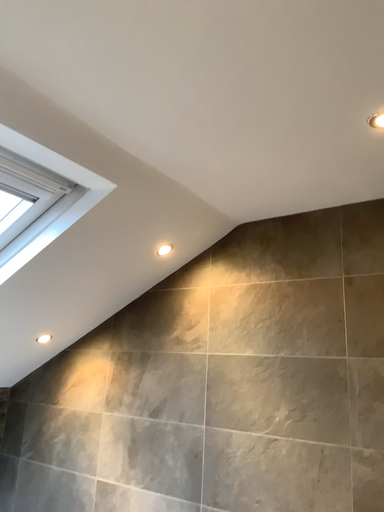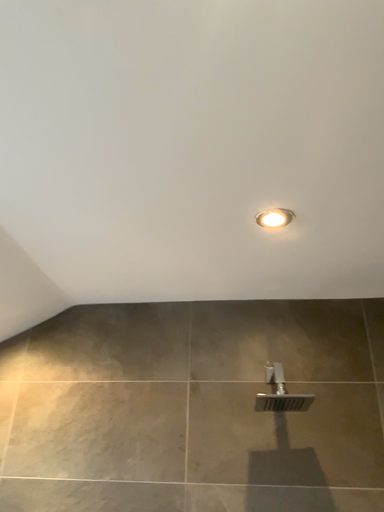
Question: How did the camera likely rotate when shooting the video?

Choices:
 (A) rotated right
 (B) rotated left

Answer: (A)